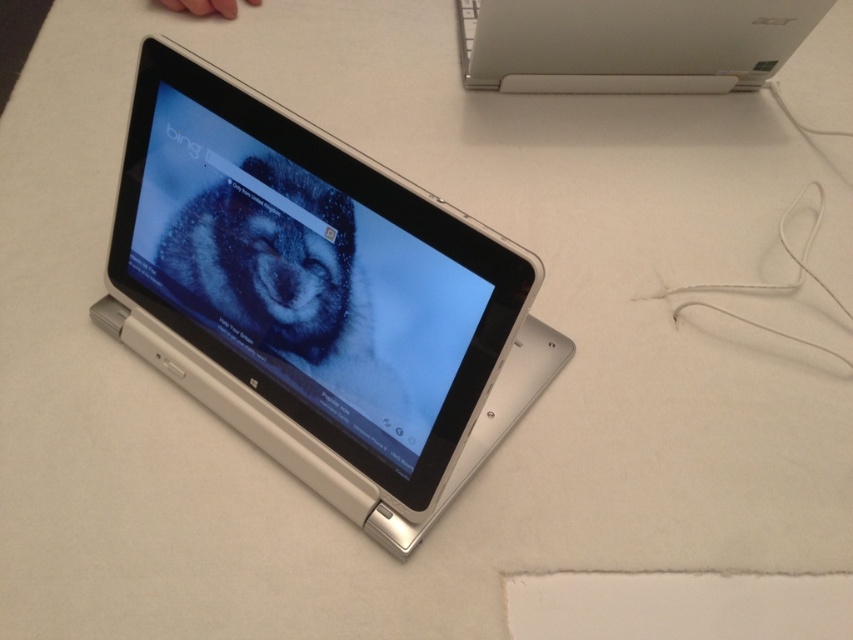
Question: Can you confirm if white plastic tablet at center is smaller than white plastic laptop at upper center?

Choices:
 (A) yes
 (B) no

Answer: (B)

Question: Which point is farther from the camera taking this photo?

Choices:
 (A) (674, 92)
 (B) (412, 376)

Answer: (A)

Question: Is white plastic tablet at center to the right of white plastic laptop at upper center from the viewer's perspective?

Choices:
 (A) yes
 (B) no

Answer: (B)

Question: Can you confirm if white plastic tablet at center is bigger than white plastic laptop at upper center?

Choices:
 (A) yes
 (B) no

Answer: (A)

Question: Among these objects, which one is farthest from the camera?

Choices:
 (A) white plastic tablet at center
 (B) white plastic laptop at upper center

Answer: (B)

Question: Which object is farther from the camera taking this photo?

Choices:
 (A) white plastic tablet at center
 (B) white plastic laptop at upper center

Answer: (B)